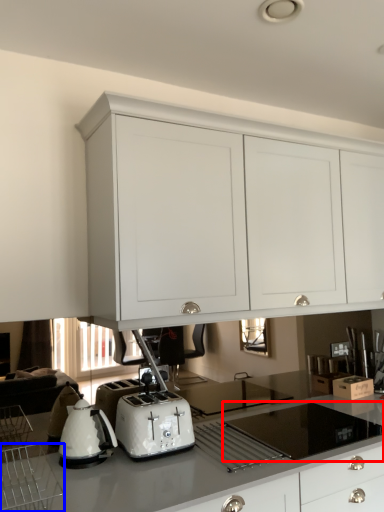
Question: Which of the following is the closest to the observer, gas stove (highlighted by a red box) or kitchen appliance (highlighted by a blue box)?

Choices:
 (A) gas stove
 (B) kitchen appliance

Answer: (B)